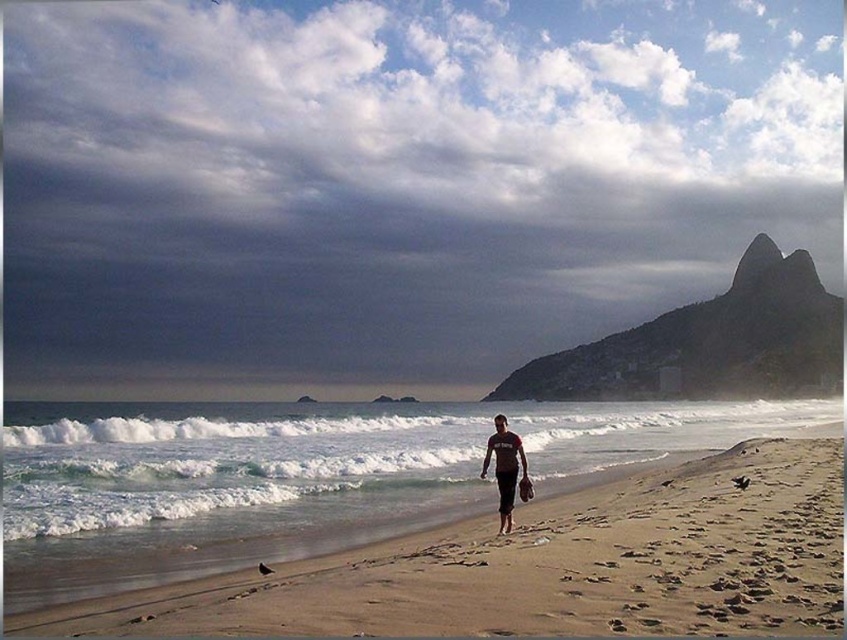
You are a photographer trying to capture the person with both the matte black shorts at center and the smooth brown surfboard at center in the same frame. Since you want the surfboard to be on the left side of the person, is the current arrangement suitable?

The matte black shorts at center is positioned on the right side of smooth brown surfboard at center, so the current arrangement is suitable because the surfboard is on the left side of the person.